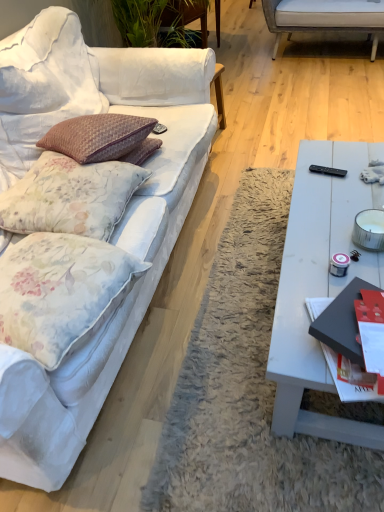
This screenshot has height=512, width=384. I want to click on empty space that is ontop of red glossy magazine at right (from a real-world perspective), so click(361, 313).